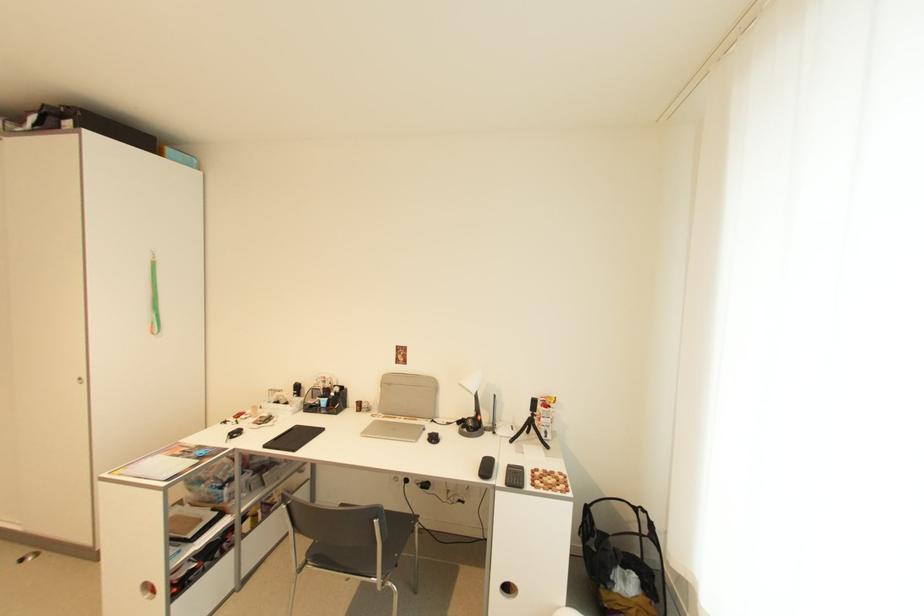
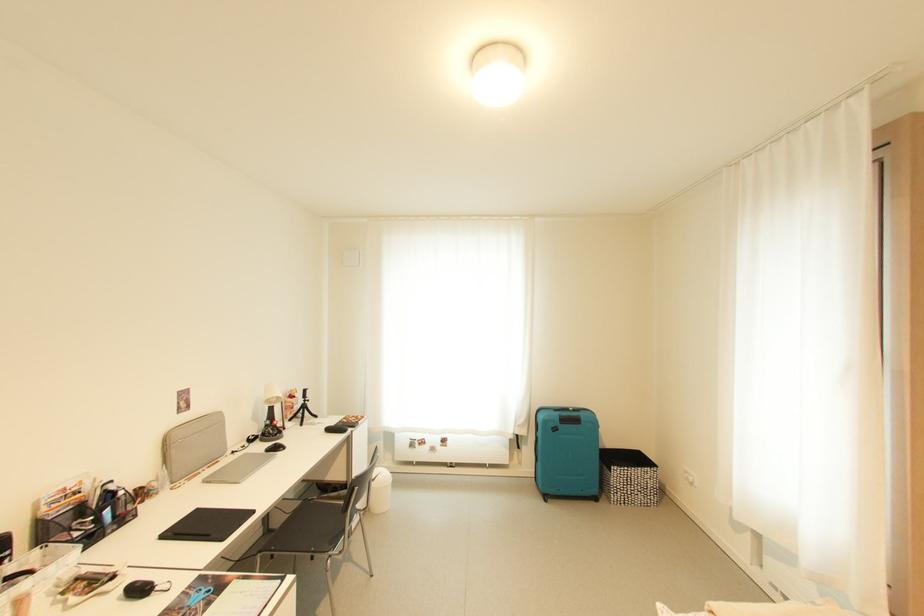
Where in the second image is the point corresponding to the point at 492,424 from the first image?

(262, 434)